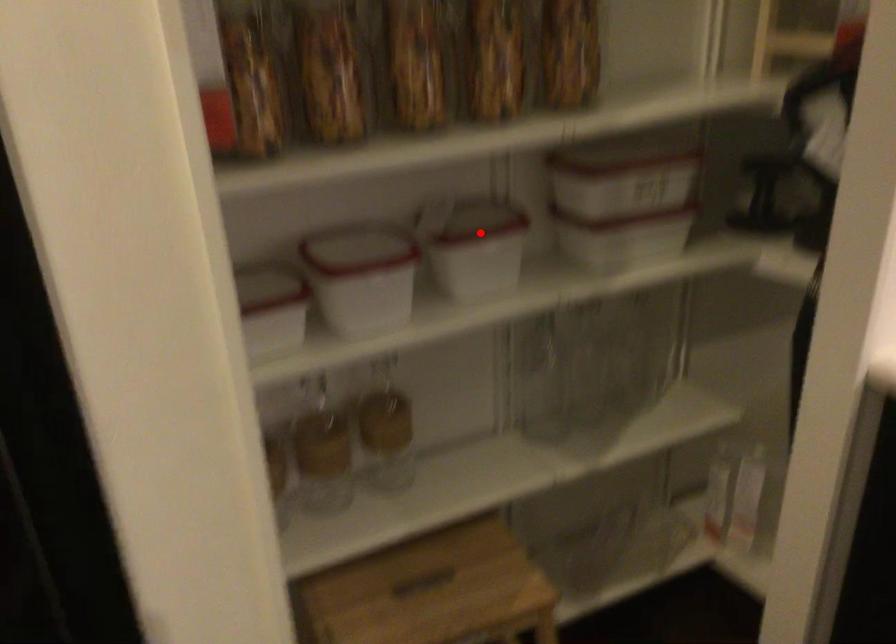
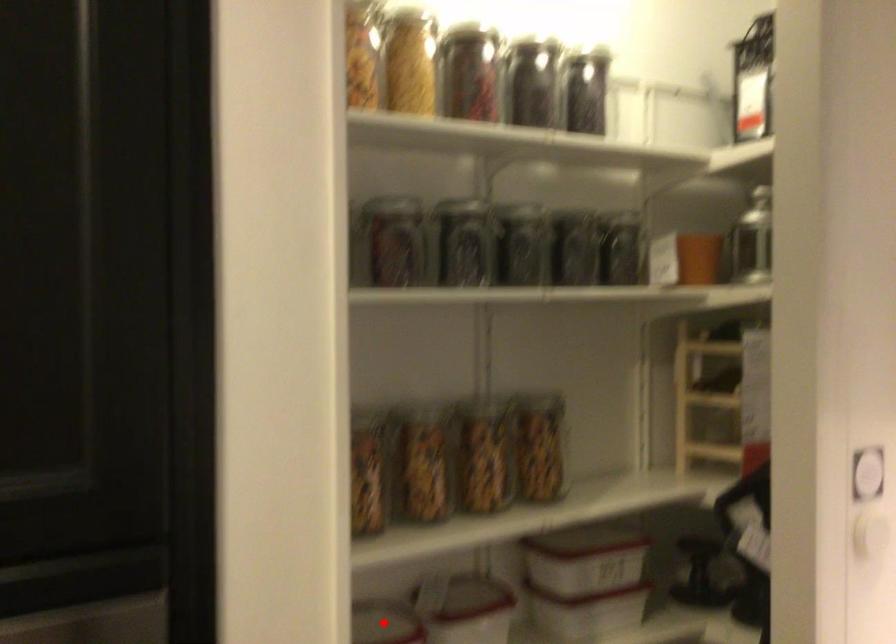
I am providing you with two images of the same scene from different viewpoints. A red point is marked on the first image and another point is marked on the second image. Are the points marked in image1 and image2 representing the same 3D position?

No